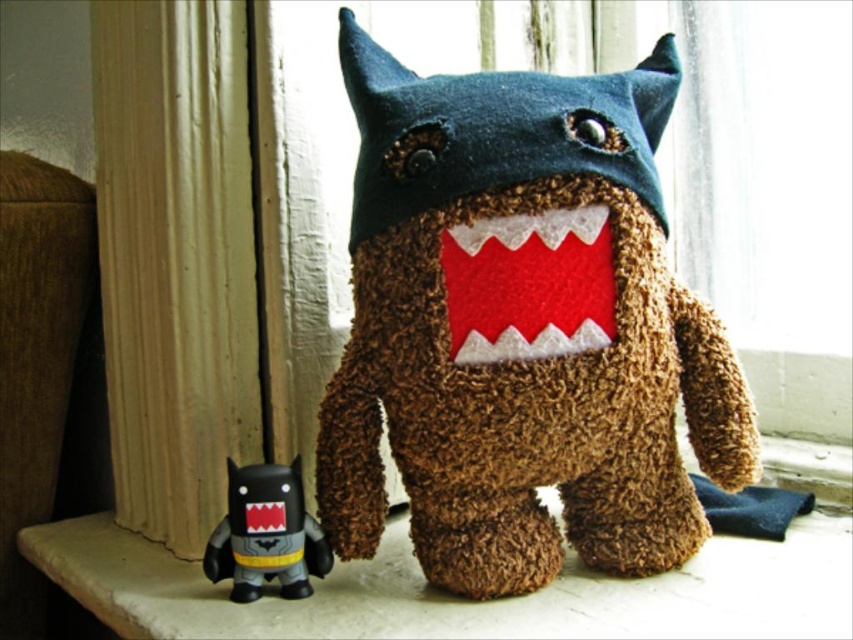
You are a photographer standing at a certain distance from the brown fuzzy stuffed toy at center. You want to take a closeup shot of it. The camera requires you to be within 25 inches to focus properly. Is the current distance sufficient?

The distance between the brown fuzzy stuffed toy at center and the camera is 27.59 inches, which is beyond the 25 inches required for proper focus. Therefore, you need to move closer to achieve a sharp closeup.

Looking at this image, you are standing in front of a windowsill with two plush toys. You notice a point at coordinates [520,332]. Which plush toy is located at that point?

The brown fuzzy stuffed toy at center is located at point [520,332].

You are a delivery robot that needs to place a new 10 inch wide package between the brown fuzzy stuffed toy at center and the matte black toy at lower left. Can the package fit in the space between them?

The brown fuzzy stuffed toy at center and the matte black toy at lower left are 9.35 inches apart. Since the package is 10 inches wide, it cannot fit in the space between them as the distance is less than the package width.